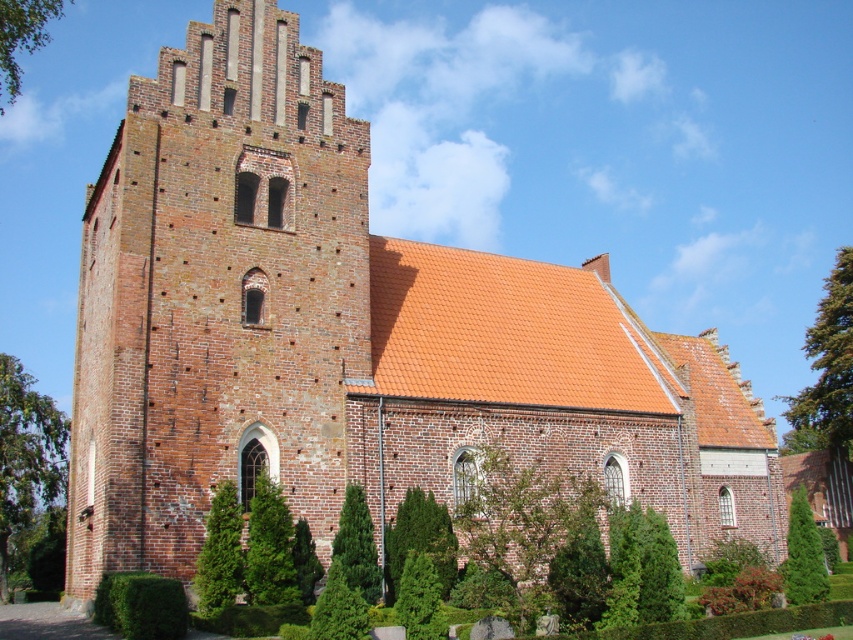
Which is above, green leafy tree at left or green coniferous tree at lower right?

green leafy tree at left is above.

Is point (35, 444) positioned before point (799, 493)?

No, it is not.

Find the location of a particular element. green leafy tree at left is located at coordinates (25, 452).

Which is below, green leafy tree at left or green leafy tree at upper right?

Positioned lower is green leafy tree at left.

Who is more distant from viewer, (39, 448) or (793, 410)?

Positioned behind is point (793, 410).

Does point (42, 438) come in front of point (848, 269)?

Yes.

The width and height of the screenshot is (853, 640). What are the coordinates of `green leafy tree at left` in the screenshot? It's located at (25, 452).

Does green leafy tree at upper right appear on the left side of green textured hedge at lower left?

Incorrect, green leafy tree at upper right is not on the left side of green textured hedge at lower left.

I want to click on green leafy tree at upper right, so click(x=827, y=369).

Where is `green leafy tree at upper right`? green leafy tree at upper right is located at coordinates (827, 369).

Find the location of `green leafy tree at upper right`. green leafy tree at upper right is located at coordinates (827, 369).